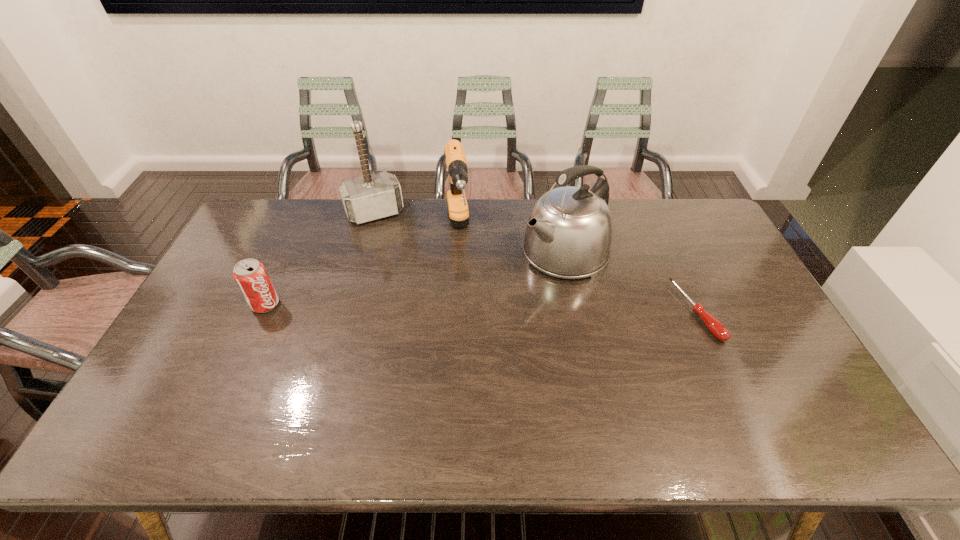
Choose which object is the nearest neighbor to the hammer. Please provide its 2D coordinates. Your answer should be formatted as a tuple, i.e. [(x, y)], where the tuple contains the x and y coordinates of a point satisfying the conditions above.

[(455, 158)]

Identify the location of blank space that satisfies the following two spatial constraints: 1. on the front side of the shortest object; 2. on the right side of the fourth object from left to right. The width and height of the screenshot is (960, 540). (576, 312).

The image size is (960, 540). Identify the location of vacant space that satisfies the following two spatial constraints: 1. on the back side of the third object from right to left; 2. on the left side of the fourth tallest object. (300, 231).

Find the location of a particular element. Image resolution: width=960 pixels, height=540 pixels. free spot that satisfies the following two spatial constraints: 1. on the front side of the hammer; 2. on the left side of the fourth object from left to right is located at coordinates (364, 252).